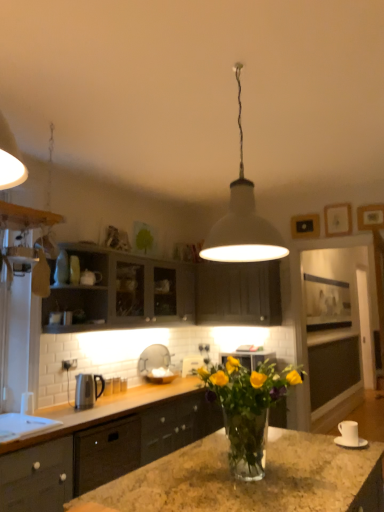
In order to face white glossy plate at upper center, the 3th appliance from the front, should I rotate leftwards or rightwards?

To face it directly, rotate right by 0.558 degrees.

Describe the element at coordinates (248, 408) in the screenshot. The width and height of the screenshot is (384, 512). I see `translucent glass vase at center` at that location.

I want to click on satin black kettle at left, the 1th appliance from the left, so click(x=87, y=390).

Would you say matte black cabinets at center, which is the first cabinetry from bottom to top, is part of matte gray cabinets at upper left, positioned as the 1th cabinetry in top-to-bottom order,'s contents?

No, matte gray cabinets at upper left, positioned as the 1th cabinetry in top-to-bottom order, does not contain matte black cabinets at center, which is the first cabinetry from bottom to top.

Locate an element on the screen. The height and width of the screenshot is (512, 384). cabinetry that is the 2nd object located below the matte gray cabinets at upper left, placed as the third cabinetry when sorted from bottom to top (from the image's perspective) is located at coordinates (102, 451).

Does point (227, 314) appear closer or farther from the camera than point (52, 451)?

Point (227, 314).

Between matte gray cabinets at upper left, placed as the third cabinetry when sorted from bottom to top, and matte black cabinets at center, which is the first cabinetry from bottom to top, which one has less height?

matte gray cabinets at upper left, placed as the third cabinetry when sorted from bottom to top.

Does satin black kettle at left, placed as the 2th appliance when sorted from back to front, have a smaller size compared to white matte pendant light at center?

Indeed, satin black kettle at left, placed as the 2th appliance when sorted from back to front, has a smaller size compared to white matte pendant light at center.

Looking at their sizes, would you say satin black kettle at left, which is the third appliance in right-to-left order, is wider or thinner than white matte pendant light at center?

satin black kettle at left, which is the third appliance in right-to-left order, is thinner than white matte pendant light at center.

Considering the points (98, 397) and (219, 242), which point is behind, point (98, 397) or point (219, 242)?

The point (98, 397) is more distant.

Is the surface of satin black kettle at left, the 2th appliance viewed from the front, in direct contact with white matte pendant light at center?

No, satin black kettle at left, the 2th appliance viewed from the front, is not with white matte pendant light at center.

Considering their positions, is white glossy sink at center located in front of or behind white matte pendant light at center?

Clearly, white glossy sink at center is behind white matte pendant light at center.

Is white glossy sink at center to the right of white matte pendant light at center from the viewer's perspective?

Incorrect, white glossy sink at center is not on the right side of white matte pendant light at center.

From a real-world perspective, is white glossy sink at center positioned under white matte pendant light at center based on gravity?

Yes, from a real-world perspective, white glossy sink at center is below white matte pendant light at center.

Is point (173, 370) closer or farther from the camera than point (237, 198)?

Point (173, 370) is farther from the camera than point (237, 198).

From a real-world perspective, count 2nd cabinetrys upward from the white glossy sink at center and point to it. Please provide its 2D coordinates.

[(165, 291)]

Do you think white glossy sink at center is within matte gray cabinets at upper left, placed as the third cabinetry when sorted from bottom to top, or outside of it?

white glossy sink at center lies outside matte gray cabinets at upper left, placed as the third cabinetry when sorted from bottom to top.

Which of these two, white glossy sink at center or matte gray cabinets at upper left, positioned as the 1th cabinetry in top-to-bottom order, is bigger?

matte gray cabinets at upper left, positioned as the 1th cabinetry in top-to-bottom order.

Looking at this image, how much distance is there between matte dark gray cabinet at center, which is counted as the 2th cabinetry, starting from the bottom, and matte gray cabinets at upper left, placed as the third cabinetry when sorted from bottom to top?

The distance of matte dark gray cabinet at center, which is counted as the 2th cabinetry, starting from the bottom, from matte gray cabinets at upper left, placed as the third cabinetry when sorted from bottom to top, is 9.15 inches.

Who is taller, matte dark gray cabinet at center, the second cabinetry positioned from the top, or matte gray cabinets at upper left, placed as the third cabinetry when sorted from bottom to top?

matte dark gray cabinet at center, the second cabinetry positioned from the top, is taller.

Based on the photo, considering the sizes of objects matte dark gray cabinet at center, which is counted as the 2th cabinetry, starting from the bottom, and matte gray cabinets at upper left, placed as the third cabinetry when sorted from bottom to top, in the image provided, who is wider, matte dark gray cabinet at center, which is counted as the 2th cabinetry, starting from the bottom, or matte gray cabinets at upper left, placed as the third cabinetry when sorted from bottom to top,?

Wider between the two is matte gray cabinets at upper left, placed as the third cabinetry when sorted from bottom to top.

Considering the relative sizes of matte dark gray cabinet at center, which is counted as the 2th cabinetry, starting from the bottom, and matte gray cabinets at upper left, positioned as the 1th cabinetry in top-to-bottom order, in the image provided, is matte dark gray cabinet at center, which is counted as the 2th cabinetry, starting from the bottom, smaller than matte gray cabinets at upper left, positioned as the 1th cabinetry in top-to-bottom order,?

Yes, matte dark gray cabinet at center, which is counted as the 2th cabinetry, starting from the bottom, is smaller than matte gray cabinets at upper left, positioned as the 1th cabinetry in top-to-bottom order.

From the image's perspective, does matte black cabinets at center, which is the first cabinetry from bottom to top, appear higher than white ceramic cup at lower right, which is the third appliance from back to front?

No, from the image's perspective, matte black cabinets at center, which is the first cabinetry from bottom to top, is not on top of white ceramic cup at lower right, which is the third appliance from back to front.

How far apart are matte black cabinets at center, which is the first cabinetry from bottom to top, and white ceramic cup at lower right, which is the third appliance from back to front?

matte black cabinets at center, which is the first cabinetry from bottom to top, and white ceramic cup at lower right, which is the third appliance from back to front, are 1.64 meters apart from each other.

From a real-world perspective, is matte black cabinets at center, marked as the third cabinetry in a top-to-bottom arrangement, above or below white ceramic cup at lower right, which is the third appliance from back to front?

Clearly, from a real-world perspective, matte black cabinets at center, marked as the third cabinetry in a top-to-bottom arrangement, is below white ceramic cup at lower right, which is the third appliance from back to front.

What's the angular difference between matte black cabinets at center, which is the first cabinetry from bottom to top, and white ceramic cup at lower right, which appears as the first appliance when viewed from the front,'s facing directions?

178 degrees.

Visually, is white glossy plate at upper center, the second appliance from the left, positioned to the left or to the right of white matte pendant light at center?

Clearly, white glossy plate at upper center, the second appliance from the left, is on the left of white matte pendant light at center in the image.

From a real-world perspective, who is located lower, white glossy plate at upper center, the 3th appliance from the front, or white matte pendant light at center?

white glossy plate at upper center, the 3th appliance from the front, is physically lower.

Considering the relative sizes of white glossy plate at upper center, the second appliance from the right, and white matte pendant light at center in the image provided, is white glossy plate at upper center, the second appliance from the right, taller than white matte pendant light at center?

Incorrect, the height of white glossy plate at upper center, the second appliance from the right, is not larger of that of white matte pendant light at center.

Does white glossy plate at upper center, the 3th appliance from the front, turn towards white matte pendant light at center?

No, white glossy plate at upper center, the 3th appliance from the front, is not facing towards white matte pendant light at center.

From a real-world perspective, count 2nd cabinetrys upward from the matte black cabinets at center, marked as the third cabinetry in a top-to-bottom arrangement, and point to it. Please provide its 2D coordinates.

[(165, 291)]

Identify the location of lamp that is in front of the satin black kettle at left, the 2th appliance viewed from the front. (243, 220).

Based on their spatial positions, is translucent glass vase at center or matte dark gray cabinet at center, which is counted as the 2th cabinetry, starting from the bottom, closer to white glossy plate at upper center, the 3th appliance from the front?

Based on the image, matte dark gray cabinet at center, which is counted as the 2th cabinetry, starting from the bottom, appears to be nearer to white glossy plate at upper center, the 3th appliance from the front.

From the image, which object appears to be nearer to satin black kettle at left, the 2th appliance viewed from the front, white matte pendant light at center or white ceramic cup at lower right, which appears as the first appliance when viewed from the front?

white ceramic cup at lower right, which appears as the first appliance when viewed from the front, is positioned closer to the anchor satin black kettle at left, the 2th appliance viewed from the front.

From the image, which object appears to be nearer to translucent glass vase at center, white glossy sink at center or white matte pendant light at center?

Among the two, white matte pendant light at center is located nearer to translucent glass vase at center.

Consider the image. Estimate the real-world distances between objects in this image. Which object is closer to matte gray cabinets at upper left, placed as the third cabinetry when sorted from bottom to top, matte black cabinets at center, marked as the third cabinetry in a top-to-bottom arrangement, or white glossy sink at center?

The object closer to matte gray cabinets at upper left, placed as the third cabinetry when sorted from bottom to top, is white glossy sink at center.

Estimate the real-world distances between objects in this image. Which object is closer to white glossy sink at center, matte dark gray cabinet at center, which is counted as the 2th cabinetry, starting from the bottom, or white ceramic cup at lower right, which is the third appliance from back to front?

matte dark gray cabinet at center, which is counted as the 2th cabinetry, starting from the bottom, is positioned closer to the anchor white glossy sink at center.

Which object lies nearer to the anchor point white matte pendant light at center, white ceramic cup at lower right, which appears as the first appliance when viewed from the front, or white glossy plate at upper center, the second appliance from the right?

Based on the image, white ceramic cup at lower right, which appears as the first appliance when viewed from the front, appears to be nearer to white matte pendant light at center.

From the image, which object appears to be farther from white glossy sink at center, translucent glass vase at center or white glossy plate at upper center, the 3th appliance from the front?

translucent glass vase at center is further to white glossy sink at center.

When comparing their distances from white glossy plate at upper center, the 3th appliance from the front, does matte black cabinets at center, which is the first cabinetry from bottom to top, or translucent glass vase at center seem closer?

matte black cabinets at center, which is the first cabinetry from bottom to top, is closer to white glossy plate at upper center, the 3th appliance from the front.

Find the location of a particular element. The width and height of the screenshot is (384, 512). appliance between matte black cabinets at center, marked as the third cabinetry in a top-to-bottom arrangement, and white glossy sink at center from front to back is located at coordinates (87, 390).

Locate an element on the screen. appliance between white matte pendant light at center and matte gray cabinets at upper left, positioned as the 1th cabinetry in top-to-bottom order, from front to back is located at coordinates (349, 436).

Locate an element on the screen. The width and height of the screenshot is (384, 512). cabinetry between matte black cabinets at center, which is the first cabinetry from bottom to top, and white glossy plate at upper center, the 3th appliance from the front, along the z-axis is located at coordinates coord(238,293).

This screenshot has height=512, width=384. I want to click on appliance located between translucent glass vase at center and matte gray cabinets at upper left, placed as the third cabinetry when sorted from bottom to top, in the depth direction, so click(349, 436).